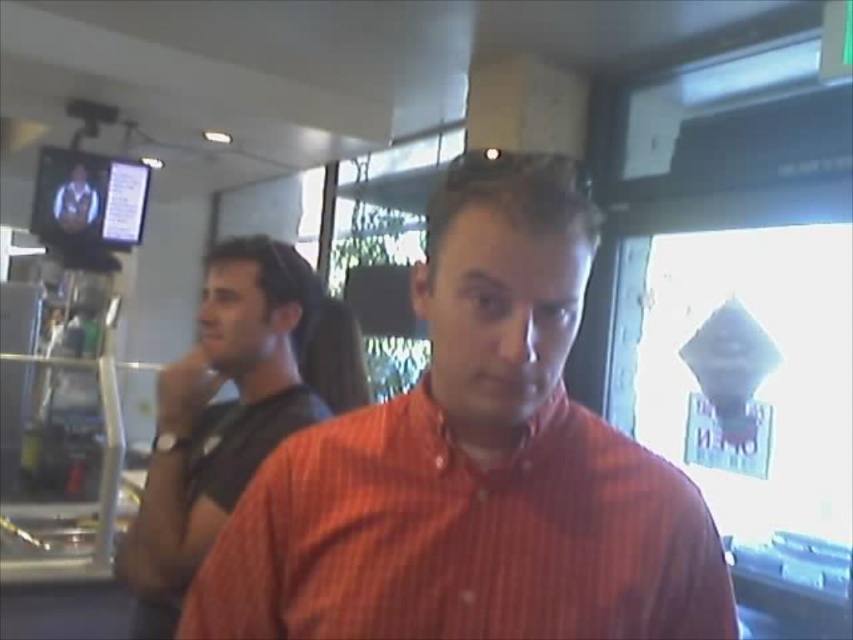
Question: Which of the following is the farthest from the observer?

Choices:
 (A) (723, 608)
 (B) (260, 340)
 (C) (68, 188)

Answer: (C)

Question: Is orange striped shirt at center bigger than black matte shirt at left?

Choices:
 (A) no
 (B) yes

Answer: (A)

Question: Estimate the real-world distances between objects in this image. Which object is farther from the black matte shirt at left?

Choices:
 (A) orange striped shirt at center
 (B) matte black shirt at upper left

Answer: (B)

Question: Can you confirm if orange striped shirt at center is smaller than matte black shirt at upper left?

Choices:
 (A) yes
 (B) no

Answer: (B)

Question: Considering the relative positions of orange striped shirt at center and black matte shirt at left in the image provided, where is orange striped shirt at center located with respect to black matte shirt at left?

Choices:
 (A) below
 (B) above

Answer: (B)

Question: Considering the real-world distances, which object is closest to the black matte shirt at left?

Choices:
 (A) orange striped shirt at center
 (B) matte black shirt at upper left

Answer: (A)